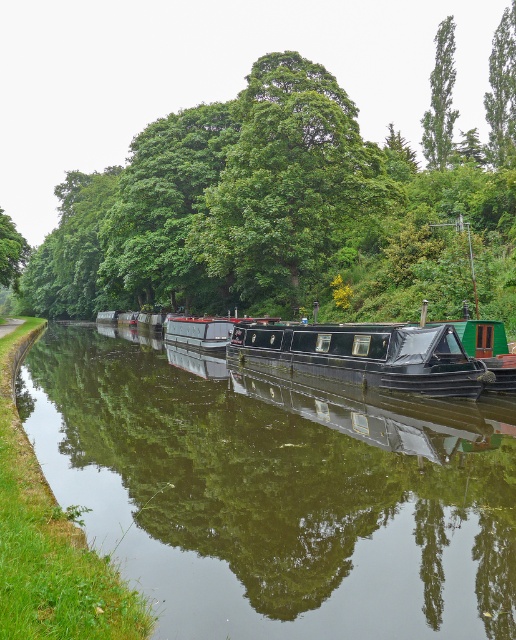
Question: Can you confirm if green leafy tree at center is positioned below green leafy tree at upper right?

Choices:
 (A) no
 (B) yes

Answer: (A)

Question: Does smooth black water at center lie in front of green leafy tree at upper center?

Choices:
 (A) no
 (B) yes

Answer: (B)

Question: Which point is farther to the camera?

Choices:
 (A) green leafy tree at upper center
 (B) smooth black water at center
 (C) green leafy tree at center

Answer: (A)

Question: Which of the following is the closest to the observer?

Choices:
 (A) (216, 506)
 (B) (453, 81)

Answer: (A)

Question: Is smooth black water at center smaller than green leafy tree at upper right?

Choices:
 (A) yes
 (B) no

Answer: (A)

Question: Which object is closer to the camera taking this photo?

Choices:
 (A) green leafy tree at center
 (B) green leafy tree at upper right
 (C) smooth black water at center

Answer: (C)